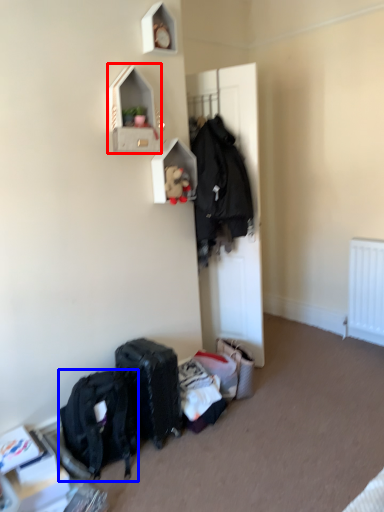
Question: Which object appears closest to the camera in this image, shelf (highlighted by a red box) or backpack (highlighted by a blue box)?

Choices:
 (A) shelf
 (B) backpack

Answer: (B)